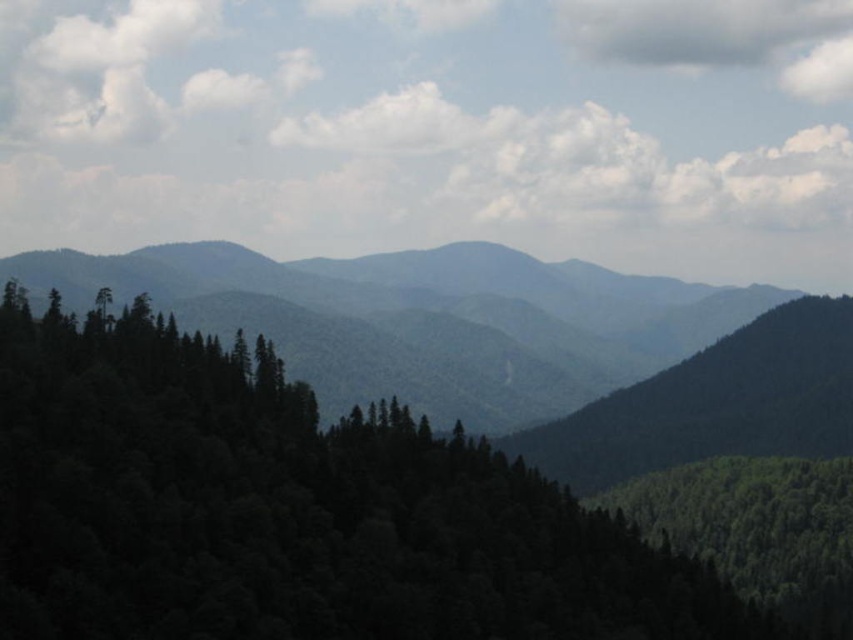
Question: Considering the relative positions of white fluffy cloud at upper center and green textured forest at center in the image provided, where is white fluffy cloud at upper center located with respect to green textured forest at center?

Choices:
 (A) left
 (B) right

Answer: (B)

Question: Which object is farther from the camera taking this photo?

Choices:
 (A) gray fluffy cloud at upper right
 (B) white fluffy cloud at upper center
 (C) green textured forest at center

Answer: (A)

Question: Observing the image, what is the correct spatial positioning of green matte trees at center in reference to gray fluffy cloud at upper right?

Choices:
 (A) right
 (B) left

Answer: (B)

Question: Among these objects, which one is farthest from the camera?

Choices:
 (A) green textured forest at center
 (B) green matte trees at center

Answer: (A)

Question: Where is white fluffy cloud at upper center located in relation to green textured forest at center in the image?

Choices:
 (A) below
 (B) above

Answer: (B)

Question: Which point is closer to the camera taking this photo?

Choices:
 (A) (757, 22)
 (B) (451, 538)
 (C) (520, 218)

Answer: (B)